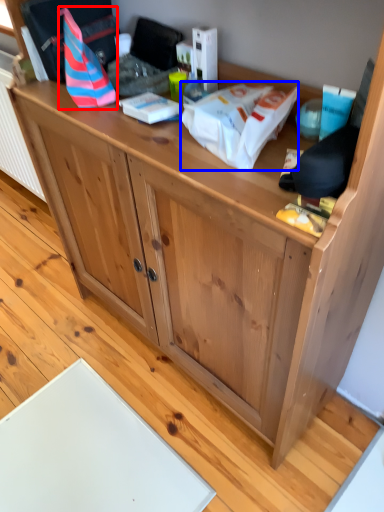
Question: Which object is closer to the camera taking this photo, kit (highlighted by a red box) or kit (highlighted by a blue box)?

Choices:
 (A) kit
 (B) kit

Answer: (B)